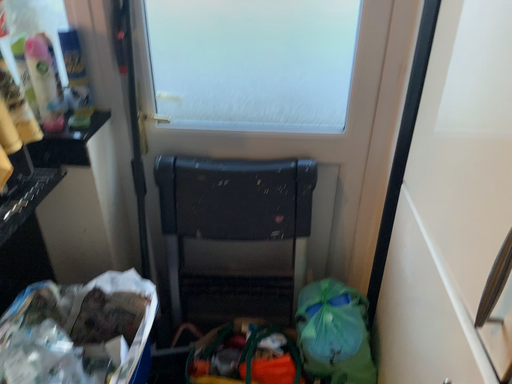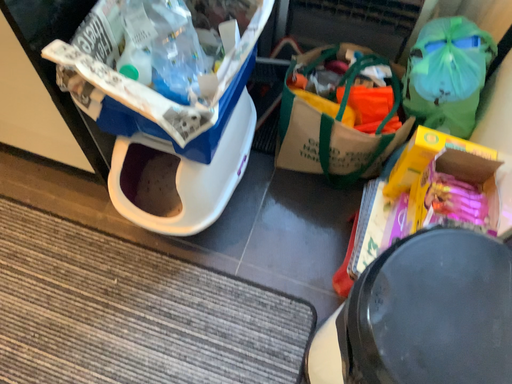
Question: Which way did the camera rotate in the video?

Choices:
 (A) rotated right
 (B) rotated left

Answer: (B)